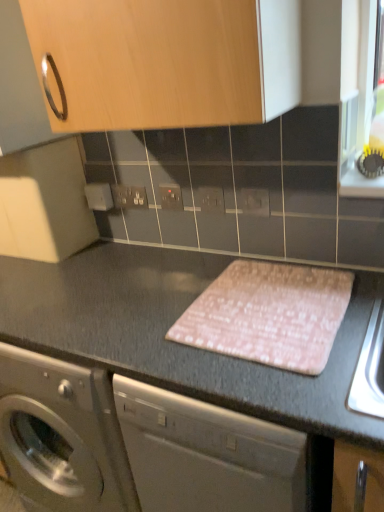
Question: Considering the positions of pink fabric at center and white plastic electric outlet at center, marked as the 2th electric outlet in a right-to-left arrangement, in the image, is pink fabric at center wider or thinner than white plastic electric outlet at center, marked as the 2th electric outlet in a right-to-left arrangement,?

Choices:
 (A) wide
 (B) thin

Answer: (A)

Question: Is pink fabric at center in front of or behind white plastic electric outlet at center, which ranks as the 3th electric outlet in left-to-right order, in the image?

Choices:
 (A) behind
 (B) front

Answer: (B)

Question: Considering the real-world distances, which object is farthest from the white plastic electric outlet at center, which ranks as the 3th electric outlet in left-to-right order?

Choices:
 (A) pink fabric placemat at center
 (B) matte gray electric outlet at center, marked as the first electric outlet in a front-to-back arrangement
 (C) matte plastic electrical outlet at center, the 3th electric outlet in the right-to-left sequence
 (D) wooden cabinet at upper center
 (E) pink fabric at center

Answer: (D)

Question: Which object is the farthest from the white plastic electrical outlet at center, which is the first electric outlet from left to right?

Choices:
 (A) matte plastic electrical outlet at center, the 3th electric outlet in the right-to-left sequence
 (B) pink fabric placemat at center
 (C) pink fabric at center
 (D) white plastic electric outlet at center, marked as the 2th electric outlet in a right-to-left arrangement
 (E) wooden cabinet at upper center

Answer: (C)